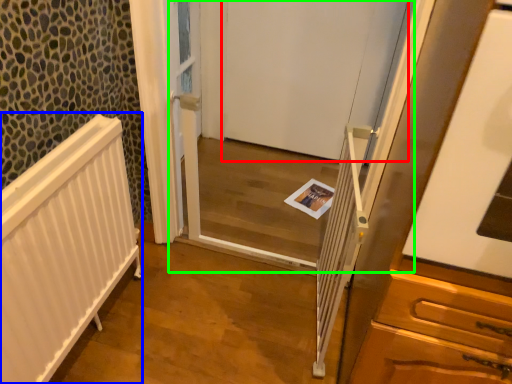
Question: Which is nearer to the door (highlighted by a red box)? radiator (highlighted by a blue box) or screen door (highlighted by a green box).

Choices:
 (A) radiator
 (B) screen door

Answer: (B)